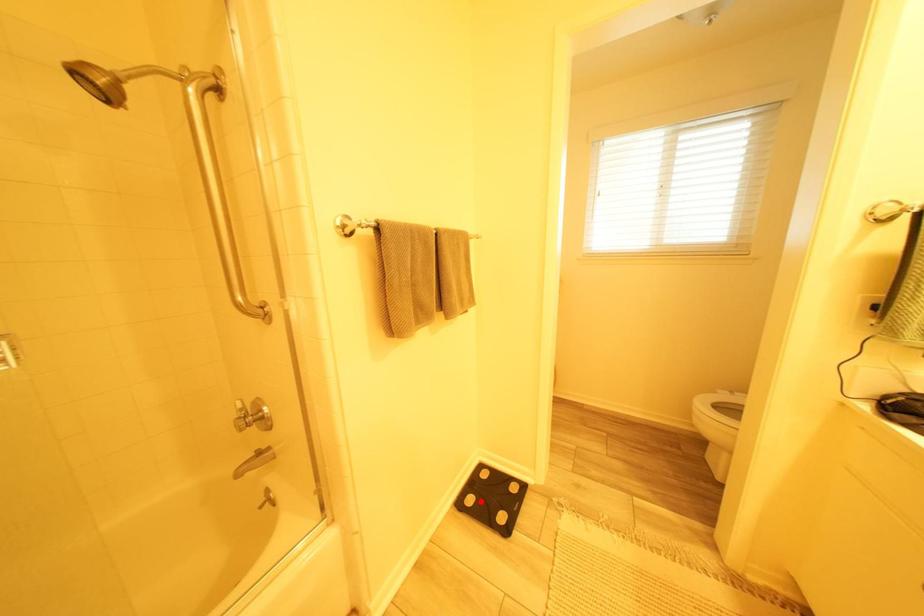
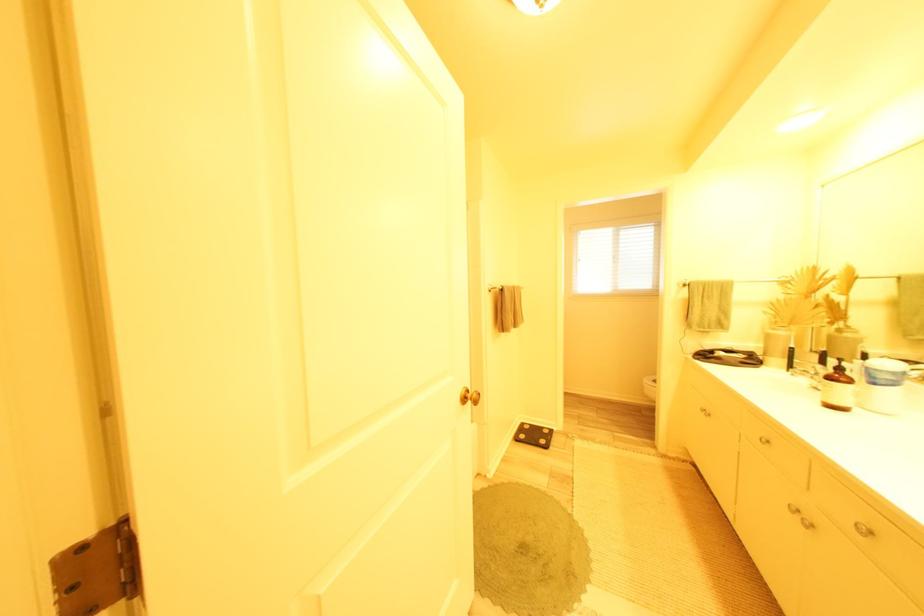
In the second image, find the point that corresponds to the highlighted location in the first image.

(532, 438)